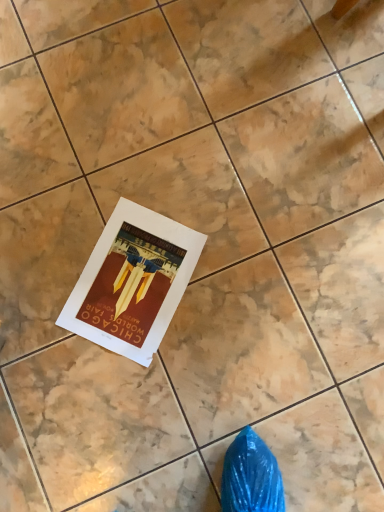
Where is `free space below matte paper poster at center (from a real-world perspective)`? The image size is (384, 512). free space below matte paper poster at center (from a real-world perspective) is located at coordinates (129, 281).